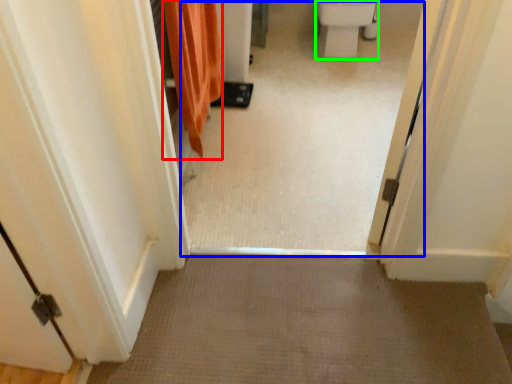
Question: Considering the real-world distances, which object is farthest from shower curtain (highlighted by a red box)? passage (highlighted by a blue box) or toilet bowl (highlighted by a green box)?

Choices:
 (A) passage
 (B) toilet bowl

Answer: (B)